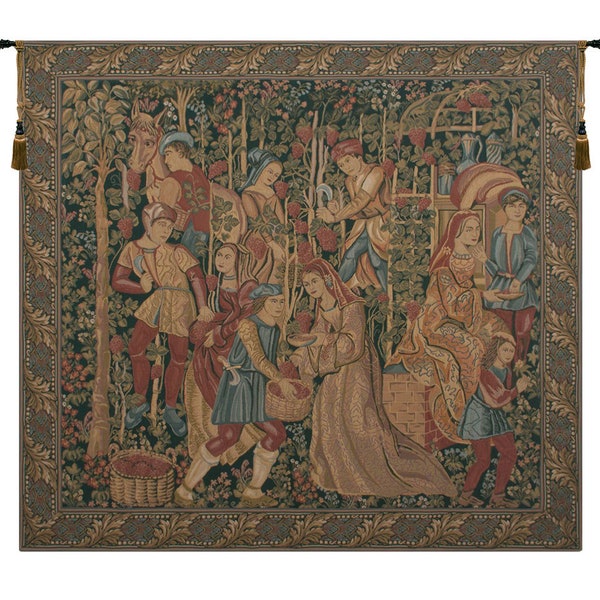
You are a GUI agent. You are given a task and a screenshot of the screen. Output one action in this format:
    pyautogui.click(x=<x>, y=<y>)
    Task: Click on the tapestry
    The width and height of the screenshot is (600, 600).
    Given the screenshot: What is the action you would take?
    pyautogui.click(x=250, y=104)